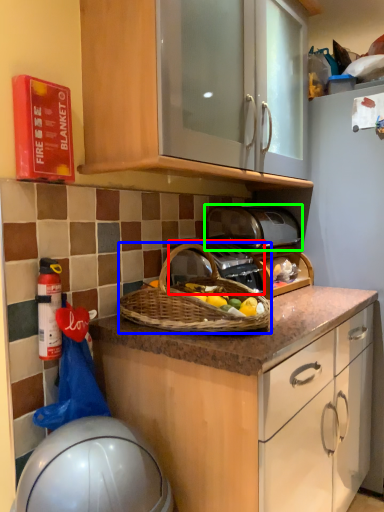
Question: Considering the real-world distances, which object is closest to gas stove (highlighted by a red box)? picnic basket (highlighted by a blue box) or toaster (highlighted by a green box).

Choices:
 (A) picnic basket
 (B) toaster

Answer: (A)